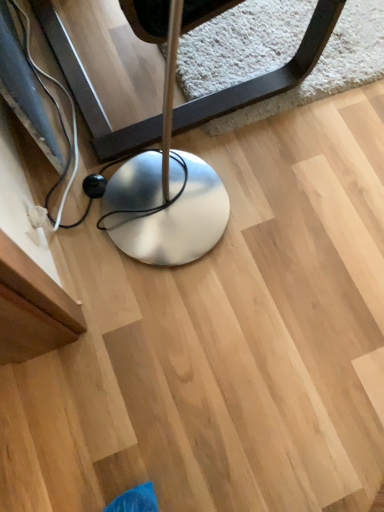
This screenshot has width=384, height=512. Find the location of `silver metallic base at center`. silver metallic base at center is located at coordinates (169, 146).

What is the approximate height of silver metallic base at center?

silver metallic base at center is 22.41 inches in height.

This screenshot has height=512, width=384. What do you see at coordinates (169, 146) in the screenshot?
I see `silver metallic base at center` at bounding box center [169, 146].

The width and height of the screenshot is (384, 512). In order to click on silver metallic base at center in this screenshot , I will do `click(169, 146)`.